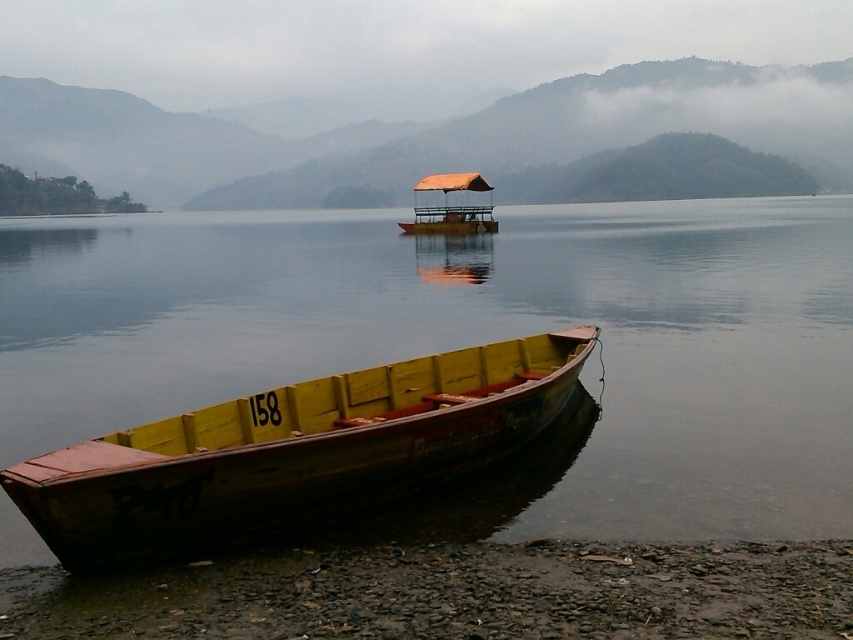
Does yellow wood boat at lower left have a lesser height compared to smooth pebbles at lower left?

Incorrect, yellow wood boat at lower left's height does not fall short of smooth pebbles at lower left's.

Can you confirm if yellow wood boat at lower left is thinner than smooth pebbles at lower left?

Incorrect, yellow wood boat at lower left's width is not less than smooth pebbles at lower left's.

What are the coordinates of `yellow wood boat at lower left` in the screenshot? It's located at (474, 342).

Measure the distance between yellow wood boat at lower left and camera.

yellow wood boat at lower left and camera are 7.04 meters apart from each other.

Is yellow wood boat at lower left shorter than orange fabric boat at center?

Indeed, yellow wood boat at lower left has a lesser height compared to orange fabric boat at center.

Which is behind, point (479, 252) or point (461, 177)?

Positioned behind is point (461, 177).

Locate an element on the screen. The width and height of the screenshot is (853, 640). yellow wood boat at lower left is located at coordinates (474, 342).

Can you confirm if yellow wooden boat at lower left is positioned to the right of orange fabric boat at center?

No, yellow wooden boat at lower left is not to the right of orange fabric boat at center.

Between point (120, 497) and point (488, 214), which one is positioned behind?

The point (488, 214) is more distant.

Who is more forward, (346, 445) or (428, 220)?

Point (346, 445) is in front.

I want to click on yellow wooden boat at lower left, so click(294, 451).